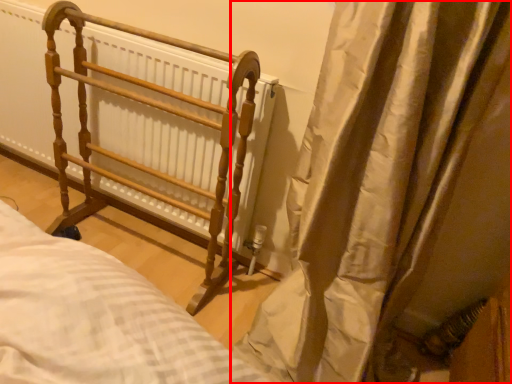
Question: From the image's perspective, where is curtain (annotated by the red box) located in relation to furniture in the image?

Choices:
 (A) below
 (B) above

Answer: (A)